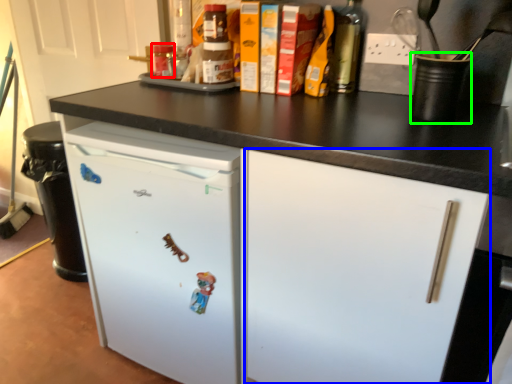
Question: Considering the real-world distances, which object is closest to bottle (highlighted by a red box)? drawer (highlighted by a blue box) or appliance (highlighted by a green box).

Choices:
 (A) drawer
 (B) appliance

Answer: (B)